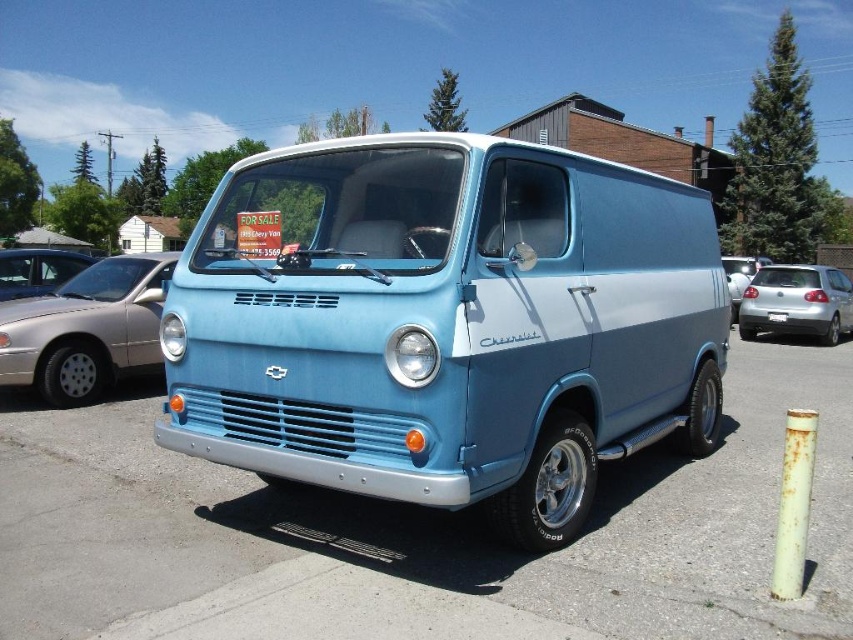
Question: Which object is the farthest from the black plastic license plate at center?

Choices:
 (A) matte blue van at center
 (B) light blue metallic van at center
 (C) metallic blue van at center
 (D) silver metallic hatchback at right

Answer: (A)

Question: Which of these objects is positioned farthest from the metallic blue van at center?

Choices:
 (A) satin silver car at center
 (B) matte silver car at left
 (C) black plastic license plate at center
 (D) light blue metallic van at center

Answer: (C)

Question: Which point is farther from the camera taking this photo?

Choices:
 (A) (56, 260)
 (B) (747, 310)

Answer: (B)

Question: Is metallic blue van at center further to the viewer compared to satin silver car at center?

Choices:
 (A) no
 (B) yes

Answer: (A)

Question: Does metallic blue van at center have a greater width compared to satin silver car at center?

Choices:
 (A) no
 (B) yes

Answer: (A)

Question: Is matte blue van at center bigger than black plastic license plate at center?

Choices:
 (A) no
 (B) yes

Answer: (B)